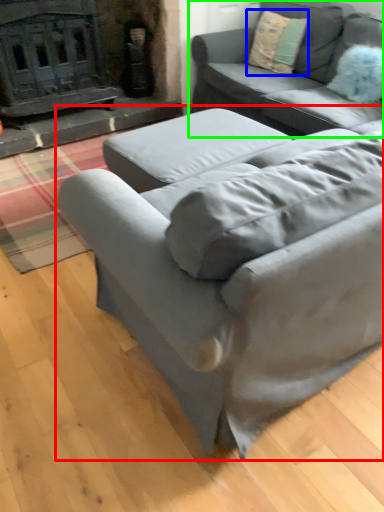
Question: Based on their relative distances, which object is farther from studio couch (highlighted by a red box)? Choose from throw pillow (highlighted by a blue box) and studio couch (highlighted by a green box).

Choices:
 (A) throw pillow
 (B) studio couch

Answer: (A)